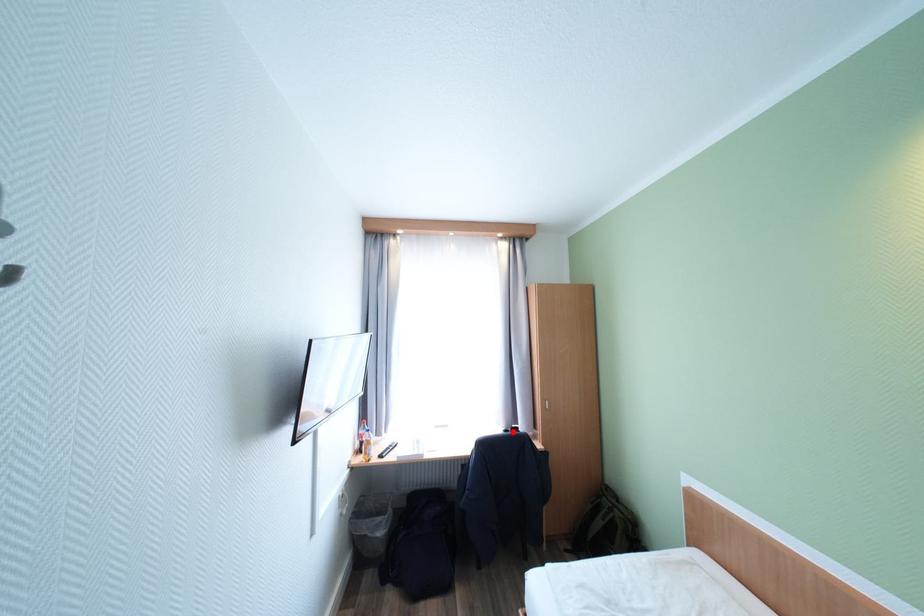
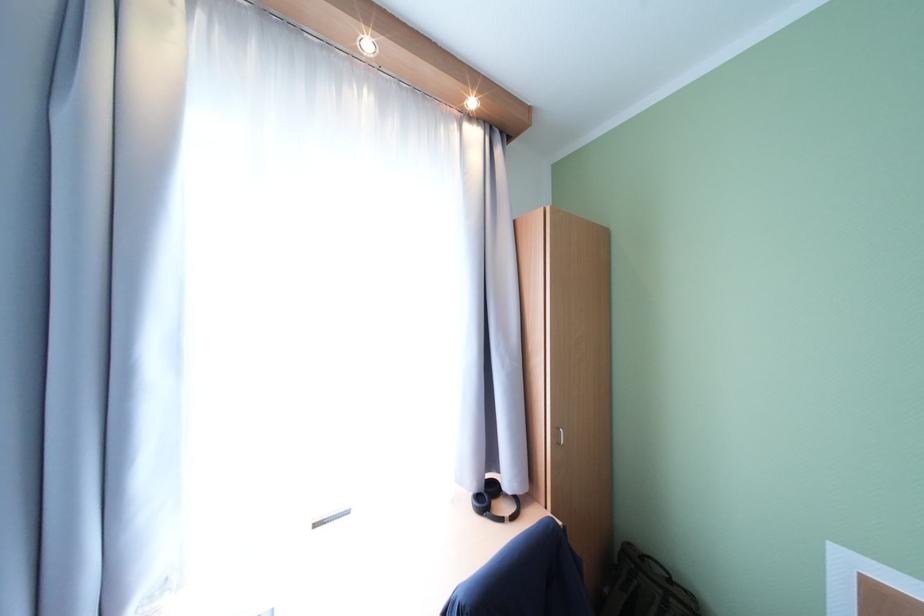
In the second image, find the point that corresponds to the highlighted location in the first image.

(484, 498)